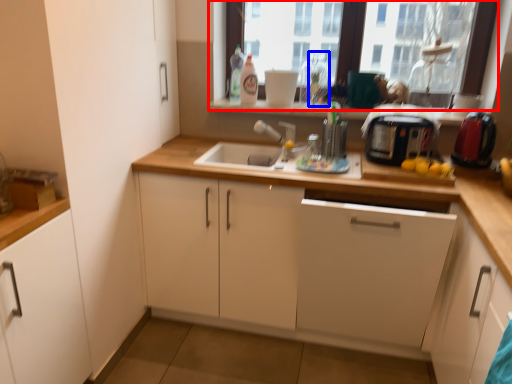
Question: Which object appears closest to the camera in this image, window (highlighted by a red box) or bottle (highlighted by a blue box)?

Choices:
 (A) window
 (B) bottle

Answer: (A)